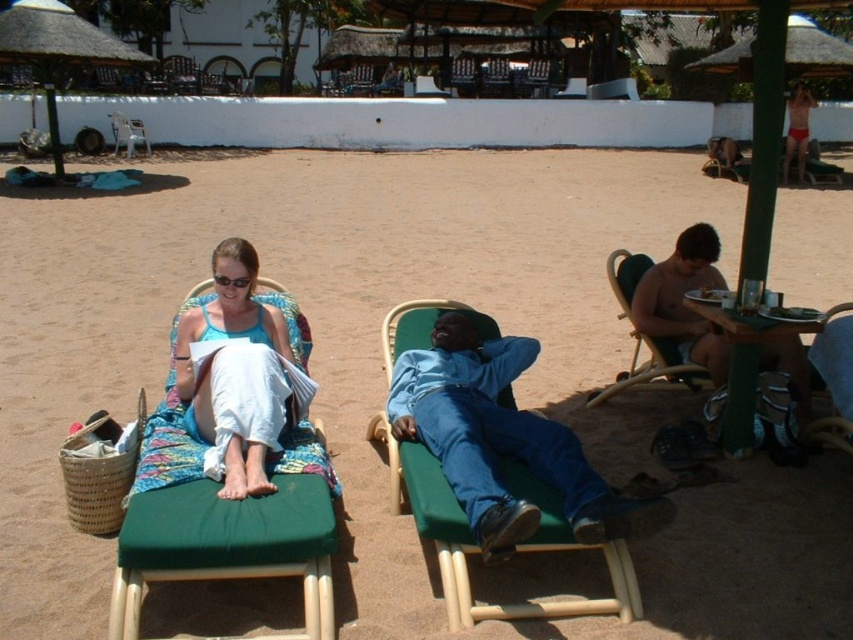
Who is lower down, green fabric beach chair at left or wooden beach chair at center?

green fabric beach chair at left is below.

Can you confirm if green fabric beach chair at left is smaller than wooden beach chair at center?

Yes, green fabric beach chair at left is smaller than wooden beach chair at center.

Between point (312, 573) and point (647, 333), which one is positioned in front?

Point (312, 573) is in front.

This screenshot has width=853, height=640. What are the coordinates of `green fabric beach chair at left` in the screenshot? It's located at (227, 545).

Looking at this image, between blue fabric beach chair at lower right and metallic silver beach chair at upper left, which one appears on the right side from the viewer's perspective?

blue fabric beach chair at lower right is more to the right.

Does blue fabric beach chair at lower right have a greater width compared to metallic silver beach chair at upper left?

No.

The width and height of the screenshot is (853, 640). Identify the location of blue fabric beach chair at lower right. (834, 378).

Who is more distant from viewer, (300, 413) or (791, 113)?

Point (791, 113)

You are a GUI agent. You are given a task and a screenshot of the screen. Output one action in this format:
    pyautogui.click(x=<x>, y=<y>)
    Task: Click on the matte blue tank top at center
    
    Given the screenshot: What is the action you would take?
    (236, 372)